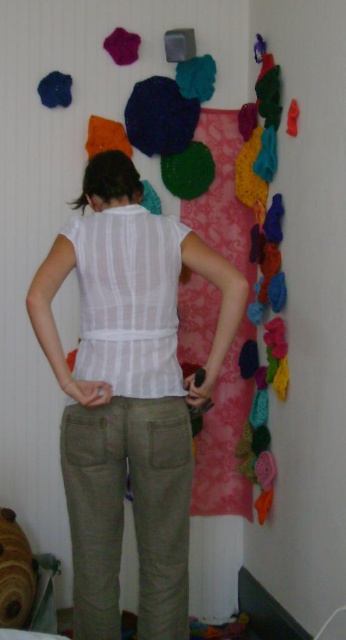
Can you confirm if light beige cotton pants at center is positioned to the left of white sheer shirt at center?

No, light beige cotton pants at center is not to the left of white sheer shirt at center.

Which of these two, light beige cotton pants at center or white sheer shirt at center, stands shorter?

white sheer shirt at center

Is point (164, 448) positioned behind point (146, 328)?

No.

I want to click on light beige cotton pants at center, so [128, 397].

The height and width of the screenshot is (640, 346). What do you see at coordinates (132, 512) in the screenshot?
I see `olive green cotton pants at lower center` at bounding box center [132, 512].

Is olive green cotton pants at lower center positioned at the back of matte blue fabric at upper left?

No, it is in front of matte blue fabric at upper left.

Who is more distant from viewer, (x=150, y=625) or (x=44, y=106)?

Positioned behind is point (x=44, y=106).

This screenshot has width=346, height=640. I want to click on olive green cotton pants at lower center, so click(x=132, y=512).

Is light beige cotton pants at center bigger than matte blue fabric at upper left?

Yes, light beige cotton pants at center is bigger than matte blue fabric at upper left.

This screenshot has height=640, width=346. Describe the element at coordinates (128, 397) in the screenshot. I see `light beige cotton pants at center` at that location.

Where is `light beige cotton pants at center`? Image resolution: width=346 pixels, height=640 pixels. light beige cotton pants at center is located at coordinates (128, 397).